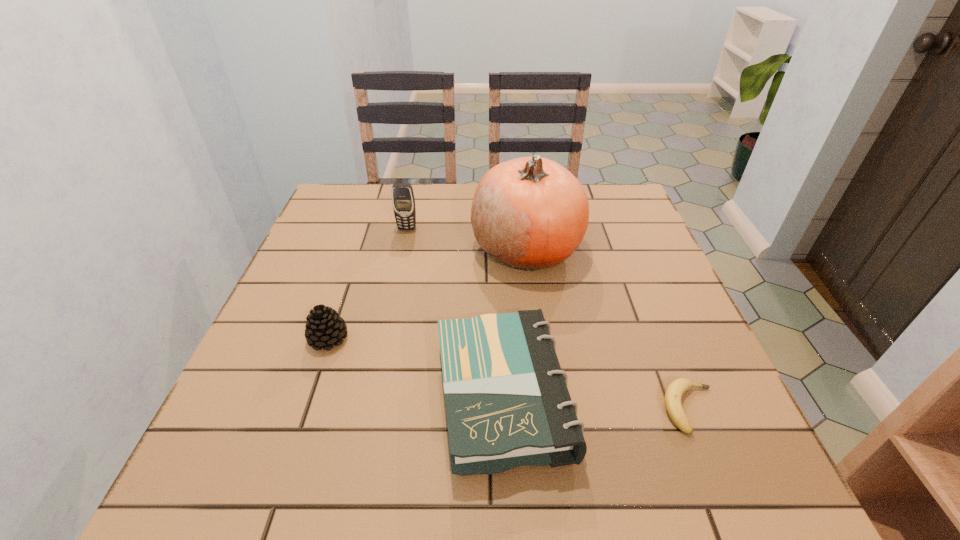
Where is `blank area at the right edge`? This screenshot has width=960, height=540. blank area at the right edge is located at coordinates (708, 426).

Where is `vacant space at the far left corner of the desktop`? The width and height of the screenshot is (960, 540). vacant space at the far left corner of the desktop is located at coordinates (365, 214).

This screenshot has height=540, width=960. In order to click on free space at the near left corner of the desktop in this screenshot , I will do `click(251, 488)`.

In the image, there is a desktop. At what (x,y) coordinates should I click in order to perform the action: click on free space at the far right corner. Please return your answer as a coordinate pair (x, y). Looking at the image, I should click on (601, 186).

You are a GUI agent. You are given a task and a screenshot of the screen. Output one action in this format:
    pyautogui.click(x=<x>, y=<y>)
    Task: Click on the free space at the near right corner of the desktop
    The width and height of the screenshot is (960, 540).
    Given the screenshot: What is the action you would take?
    pyautogui.click(x=724, y=472)

This screenshot has height=540, width=960. Identify the location of blank region between the paperback book and the cellular telephone. (455, 313).

At what (x,y) coordinates should I click in order to perform the action: click on free space between the leftmost object and the fourth object from right to left. Please return your answer as a coordinate pair (x, y). The width and height of the screenshot is (960, 540). Looking at the image, I should click on (368, 284).

Find the location of a particular element. The width and height of the screenshot is (960, 540). empty space between the cellular telephone and the pinecone is located at coordinates (368, 284).

At what (x,y) coordinates should I click in order to perform the action: click on vacant region between the pinecone and the pumpkin. Please return your answer as a coordinate pair (x, y). This screenshot has width=960, height=540. Looking at the image, I should click on pos(427,293).

Locate an element on the screen. free point between the paperback book and the second object from left to right is located at coordinates (x=455, y=313).